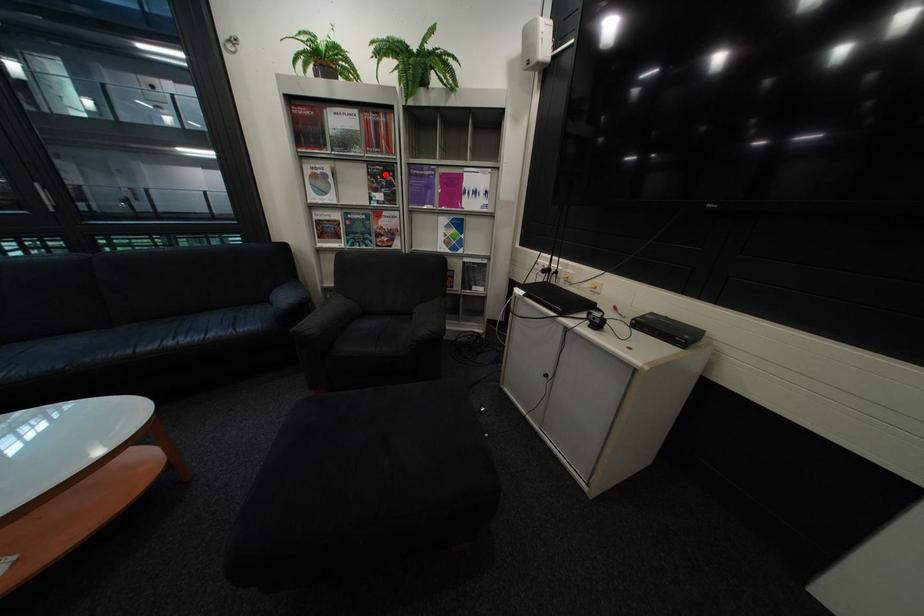
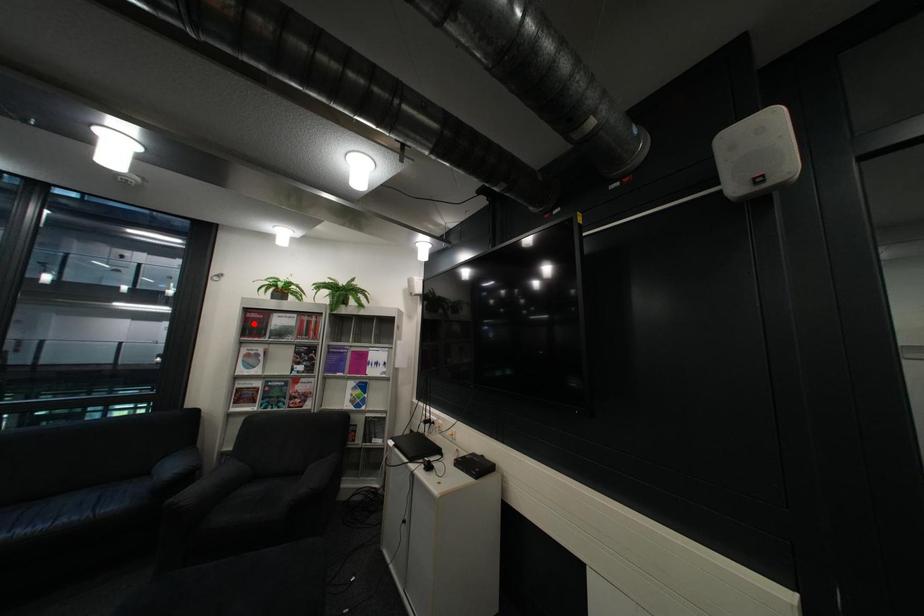
I am providing you with two images of the same scene from different viewpoints. A red point is marked on the first image and another point is marked on the second image. Does the point marked in image1 correspond to the same location as the one in image2?

No